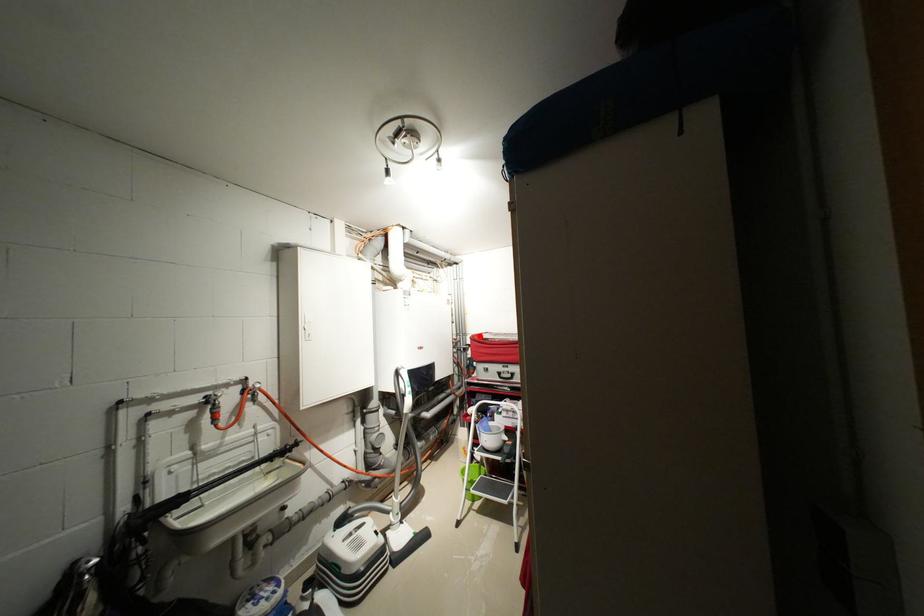
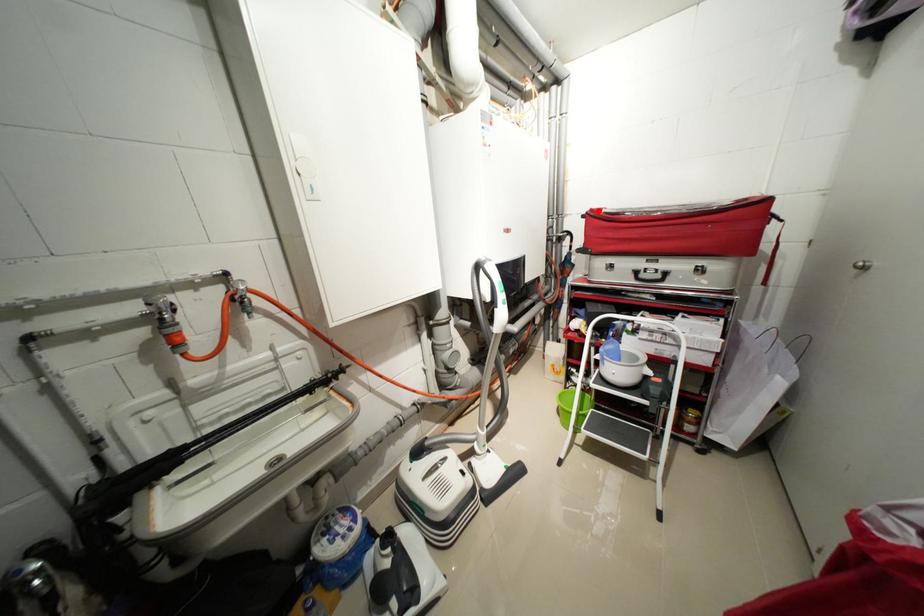
I am providing you with two images of the same scene from different viewpoints. A red point is marked on the first image and another point is marked on the second image. Is the red point in image1 aligned with the point shown in image2?

Yes